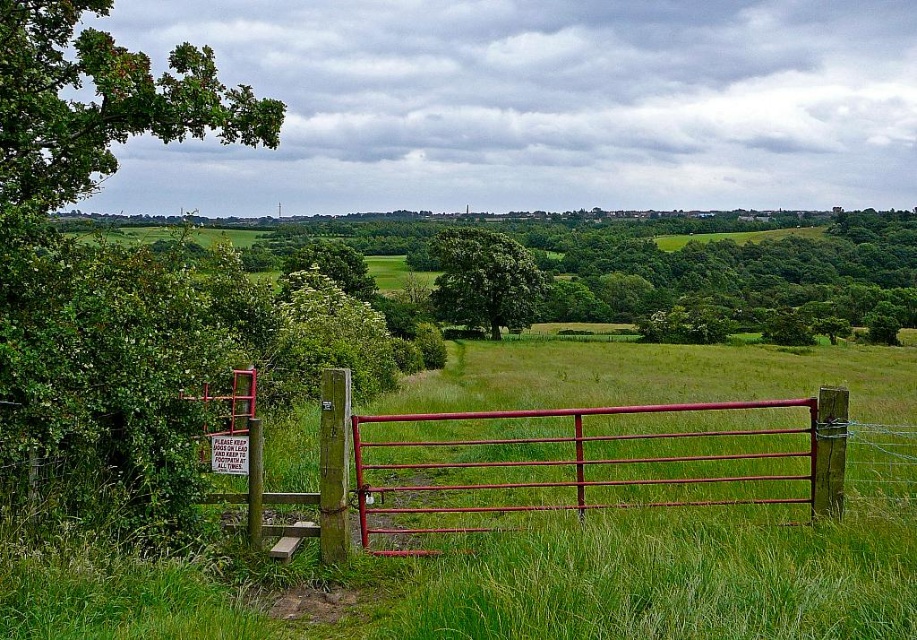
Question: Which object appears closest to the camera in this image?

Choices:
 (A) smooth metal gate at center
 (B) green leafy tree at center

Answer: (A)

Question: Can you confirm if smooth metal gate at center is bigger than green leafy tree at center?

Choices:
 (A) no
 (B) yes

Answer: (A)

Question: Among these objects, which one is farthest from the camera?

Choices:
 (A) green leafy tree at center
 (B) smooth metal gate at center

Answer: (A)

Question: Is smooth metal gate at center thinner than green leafy tree at center?

Choices:
 (A) no
 (B) yes

Answer: (B)

Question: Observing the image, what is the correct spatial positioning of smooth metal gate at center in reference to green leafy tree at center?

Choices:
 (A) left
 (B) right

Answer: (B)